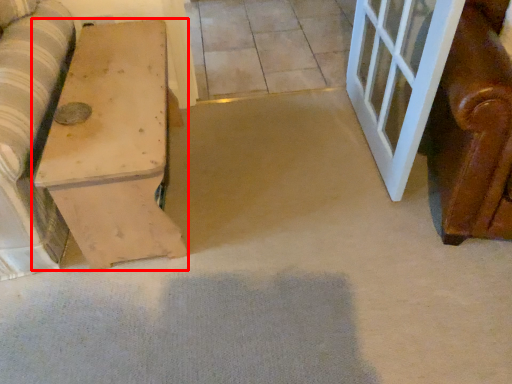
Question: From the image's perspective, what is the correct spatial relationship of furniture (annotated by the red box) in relation to tile?

Choices:
 (A) below
 (B) above

Answer: (A)